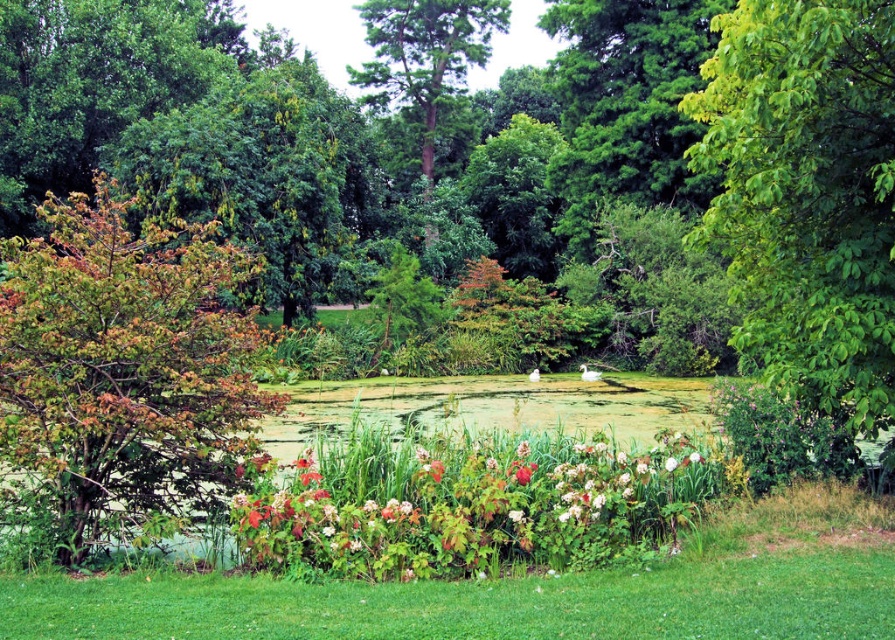
You are standing at the edge of the pond and want to take a photo of the multicolored foliage bush at left. If your camera has a maximum focus range of 7 meters, will it be able to capture the bush clearly?

The multicolored foliage bush at left is 7.59 meters away from camera, which is beyond the camera maximum focus range of 7 meters. So the camera cannot capture the bush clearly.

You are a bird looking for a nesting spot. You see the multicolored foliage bush at left and the green leafy tree at right. Which would provide a higher vantage point?

The green leafy tree at right is taller than the multicolored foliage bush at left, so it would provide a higher vantage point.